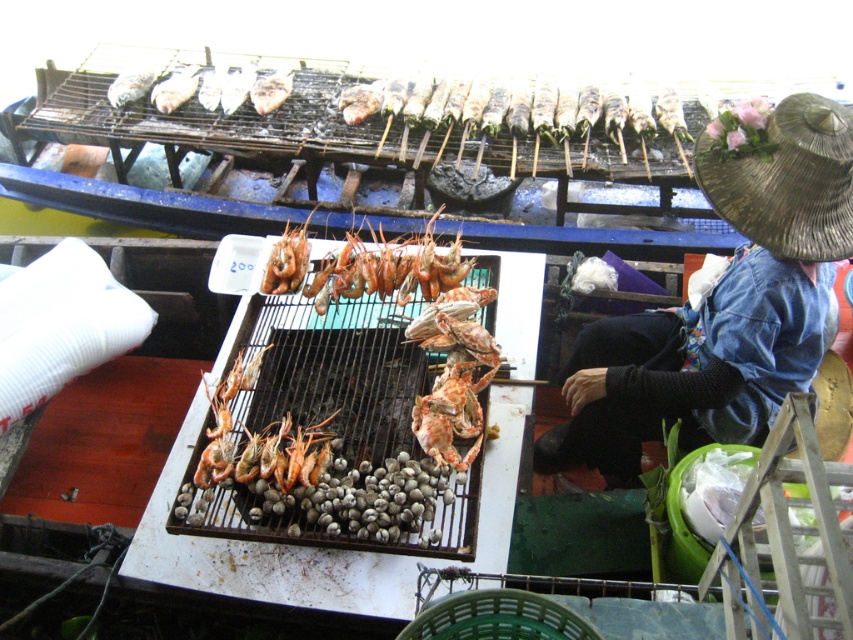
You are a customer at the seafood barbecue stall. You notice a brown woven straw hat at upper right and a shiny orange shrimp at center. Which object is wider?

The brown woven straw hat at upper right might be wider than the shiny orange shrimp at center.

You are a customer at the seafood barbecue stall. You see the brown woven straw hat at upper right and the shiny orange shrimp at center. Which item is larger in size?

The brown woven straw hat at upper right is bigger than the shiny orange shrimp at center.